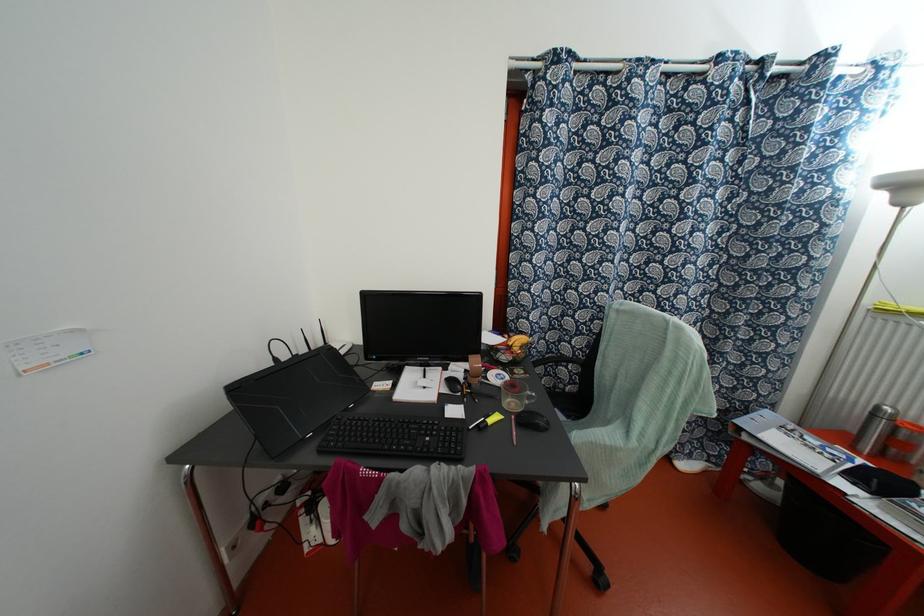
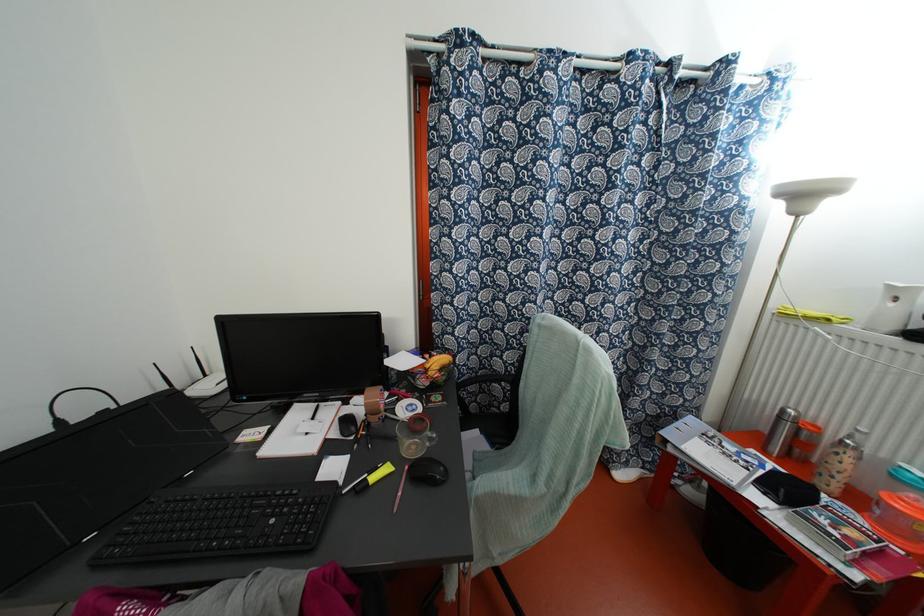
Question: The first image is from the beginning of the video and the second image is from the end. How did the camera likely rotate when shooting the video?

Choices:
 (A) Left
 (B) Right
 (C) Up
 (D) Down

Answer: (B)